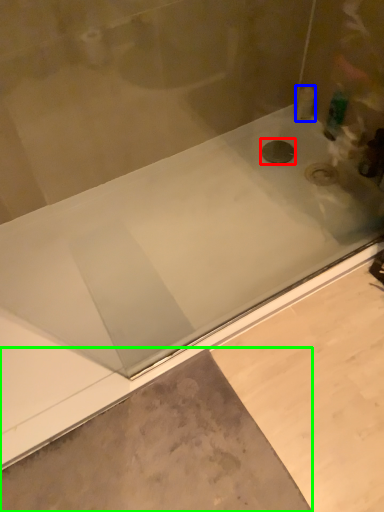
Question: Which object is positioned closest to drain (highlighted by a red box)? Select from toiletry (highlighted by a blue box) and concrete (highlighted by a green box).

Choices:
 (A) toiletry
 (B) concrete

Answer: (A)